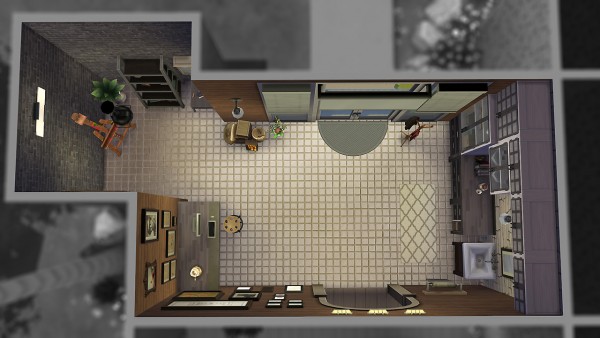
This screenshot has width=600, height=338. Identify the location of plant. (280, 130).